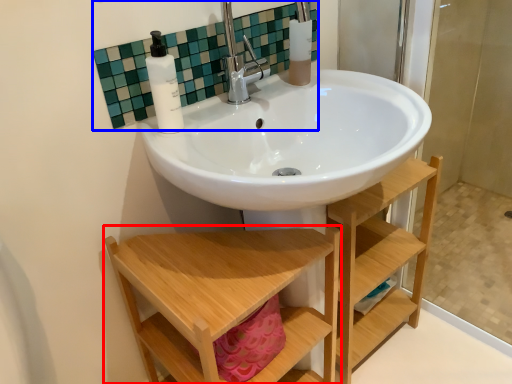
Question: Among these objects, which one is farthest to the camera, furniture (highlighted by a red box) or mirror (highlighted by a blue box)?

Choices:
 (A) furniture
 (B) mirror

Answer: (B)